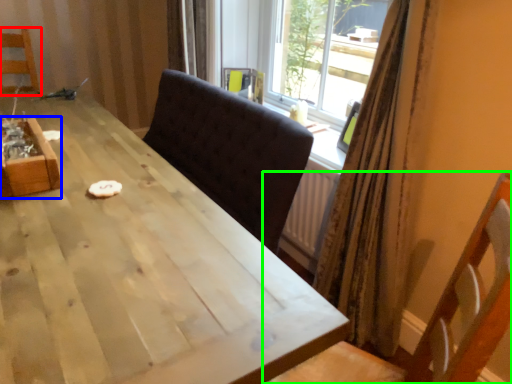
Question: Which object is the closest to the chair (highlighted by a red box)? Choose among these: crate (highlighted by a blue box) or chair (highlighted by a green box).

Choices:
 (A) crate
 (B) chair

Answer: (A)